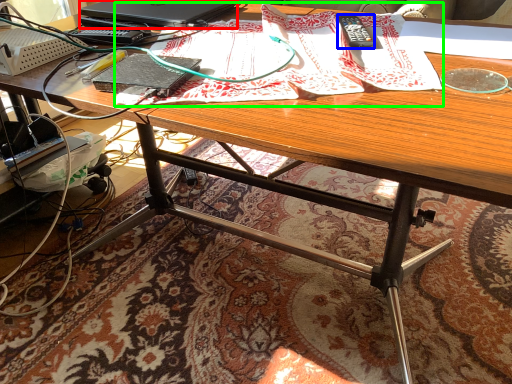
Question: Which object is the closest to the laptop (highlighted by a red box)? Choose among these: remote control (highlighted by a blue box) or wrapping paper (highlighted by a green box).

Choices:
 (A) remote control
 (B) wrapping paper

Answer: (B)